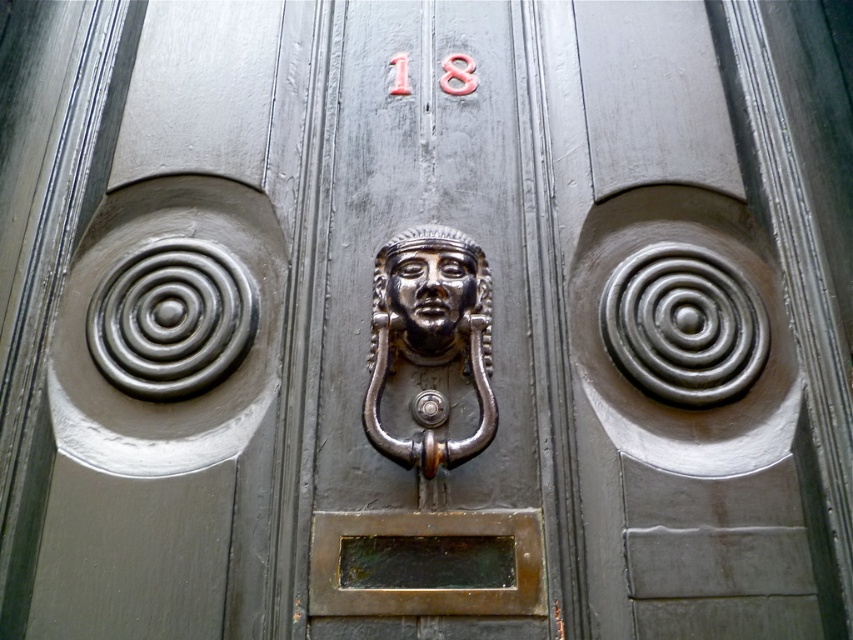
Is polished bronze head at center wider than polished silver door knocker at center?

Yes.

Which is more to the left, polished bronze head at center or polished silver door knocker at center?

Positioned to the left is polished silver door knocker at center.

Is point (418, 252) positioned before point (419, 420)?

No.

Where is `polished bronze head at center`? This screenshot has width=853, height=640. polished bronze head at center is located at coordinates coord(430,333).

Is polished bronze face at center positioned behind polished silver door knocker at center?

No.

Does polished bronze face at center have a lesser width compared to polished silver door knocker at center?

No.

Which is behind, point (460, 268) or point (428, 392)?

Point (460, 268)

You are a GUI agent. You are given a task and a screenshot of the screen. Output one action in this format:
    pyautogui.click(x=<x>, y=<y>)
    Task: Click on the polished bronze face at center
    The height and width of the screenshot is (640, 853).
    Given the screenshot: What is the action you would take?
    pyautogui.click(x=430, y=292)

Can you confirm if polished bronze head at center is smaller than polished bronze face at center?

Actually, polished bronze head at center might be larger than polished bronze face at center.

Which of these two, polished bronze head at center or polished bronze face at center, stands taller?

polished bronze head at center

The width and height of the screenshot is (853, 640). Identify the location of polished bronze head at center. [x=430, y=333].

I want to click on polished bronze head at center, so click(430, 333).